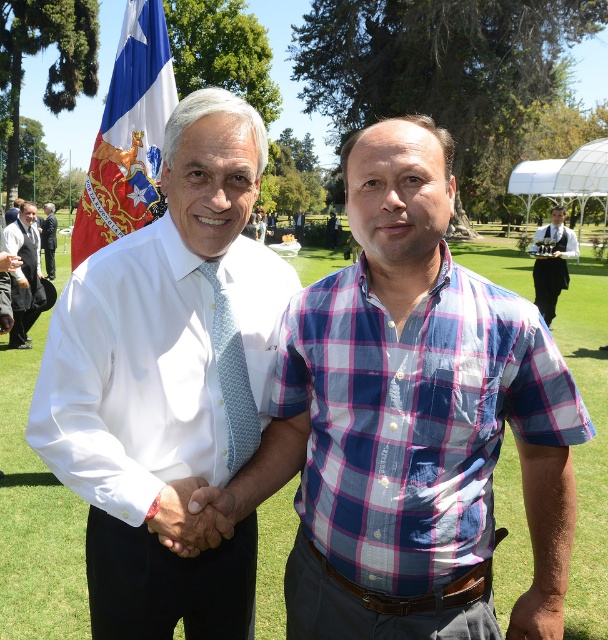
Is blue textured tie at center bigger than black uniform at right?

No, blue textured tie at center is not bigger than black uniform at right.

Does blue textured tie at center appear on the left side of black uniform at right?

Correct, you'll find blue textured tie at center to the left of black uniform at right.

Who is more forward, (237, 456) or (544, 236)?

Point (237, 456) is more forward.

Find the location of `blue textured tie at center`. blue textured tie at center is located at coordinates (232, 376).

Is point (424, 419) behind point (15, 276)?

No, (424, 419) is in front of (15, 276).

Can you confirm if blue plaid shirt at center is bigger than dark gray suit at left?

No.

Is point (350, 348) positioned after point (29, 240)?

No, it is in front of (29, 240).

Image resolution: width=608 pixels, height=640 pixels. Identify the location of blue plaid shirt at center. (406, 412).

Can you confirm if blue plaid shirt at center is positioned below black uniform at right?

Yes.

Is blue plaid shirt at center wider than black uniform at right?

No.

Between point (451, 420) and point (561, 282), which one is positioned in front?

Point (451, 420)

Identify the location of blue plaid shirt at center. (406, 412).